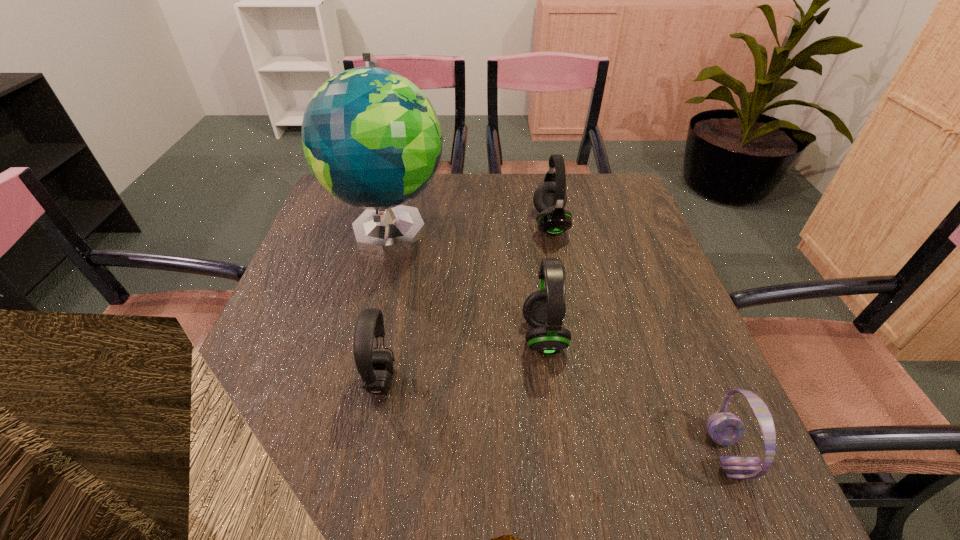
I want to click on free space located on the headband and ear cups of the rightmost object, so click(x=574, y=454).

Find the location of `vacant space situated 0.050m on the headband and ear cups of the rightmost object`. vacant space situated 0.050m on the headband and ear cups of the rightmost object is located at coordinates (680, 454).

The image size is (960, 540). Identify the location of vacant space located 0.120m on the headband and ear cups of the rightmost object. (638, 454).

Identify the location of globe at the far edge. This screenshot has height=540, width=960. (371, 137).

Locate an element on the screen. The height and width of the screenshot is (540, 960). headset located at the far edge is located at coordinates (550, 197).

At what (x,y) coordinates should I click in order to perform the action: click on object that is positioned at the near edge. Please return your answer as a coordinate pair (x, y). The height and width of the screenshot is (540, 960). Looking at the image, I should click on (726, 429).

You are a GUI agent. You are given a task and a screenshot of the screen. Output one action in this format:
    pyautogui.click(x=<x>, y=<y>)
    Task: Click on the object located at the left edge
    The width and height of the screenshot is (960, 540).
    Given the screenshot: What is the action you would take?
    pyautogui.click(x=371, y=137)

Find the location of a particular element. The width and height of the screenshot is (960, 540). object that is at the right edge is located at coordinates (726, 429).

The width and height of the screenshot is (960, 540). I want to click on object located at the far left corner, so pyautogui.click(x=371, y=137).

Locate an element on the screen. object that is positioned at the near right corner is located at coordinates (726, 429).